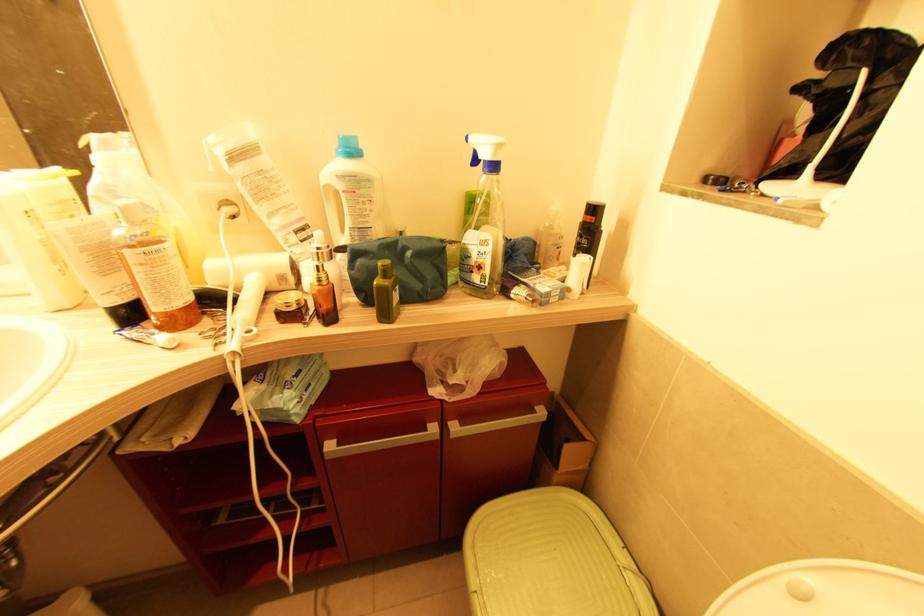
Where is `white pump dispenser`? Image resolution: width=924 pixels, height=616 pixels. white pump dispenser is located at coordinates click(x=483, y=223).